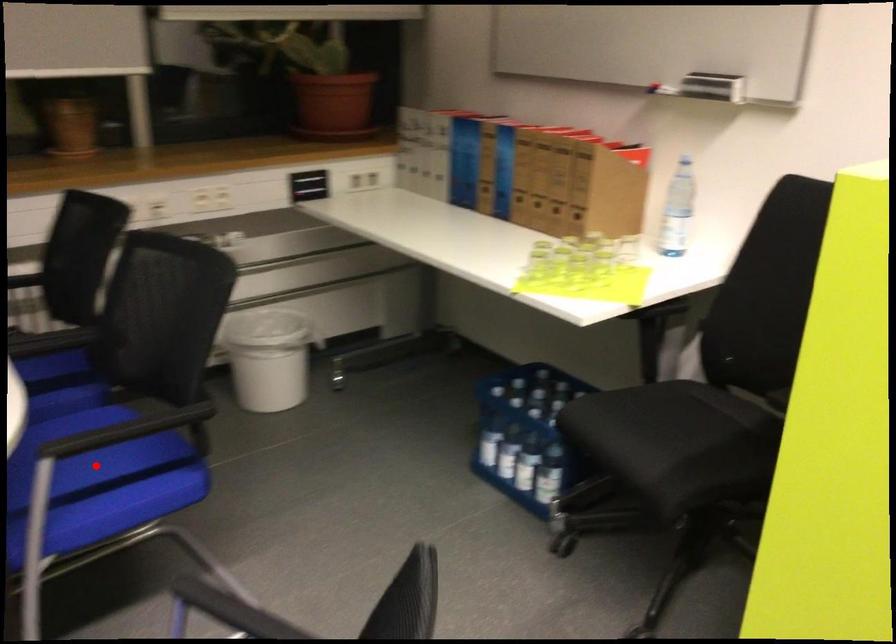
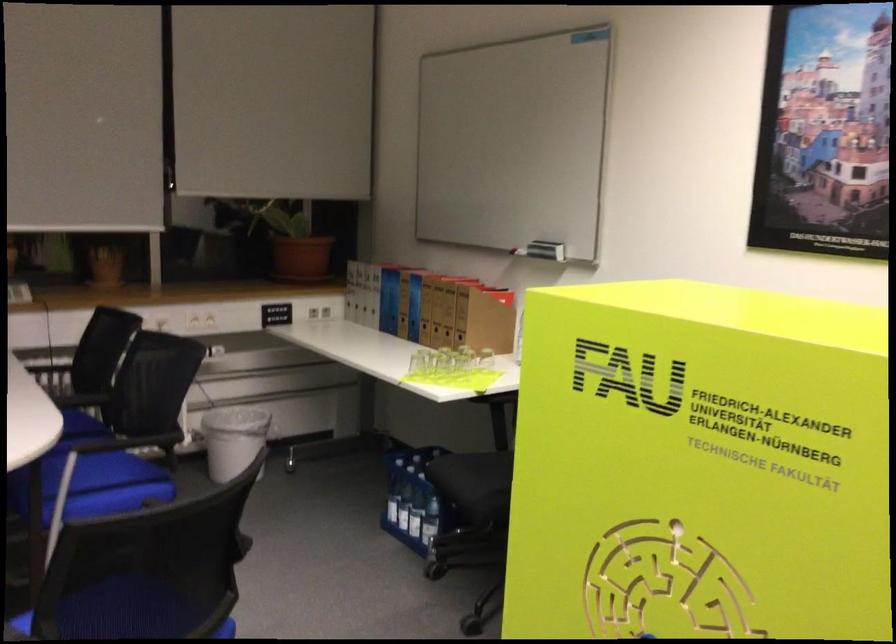
Where in the second image is the point corresponding to the highlighted location from the first image?

(95, 485)